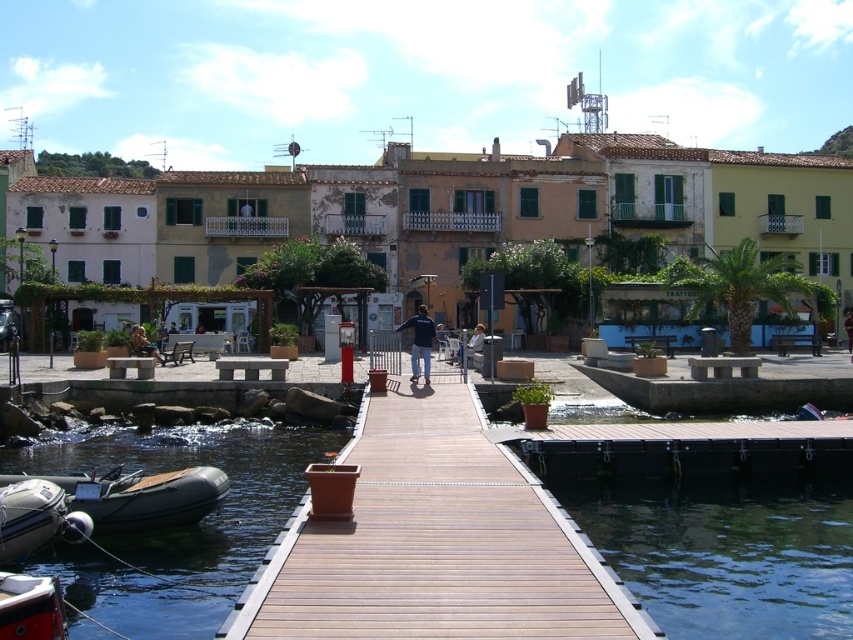
Question: Where is transparent blue water at dock center located in relation to rubber boat at lower left in the image?

Choices:
 (A) below
 (B) above

Answer: (A)

Question: Among these objects, which one is nearest to the camera?

Choices:
 (A) dark blue jacket at center
 (B) light blue denim jeans at center

Answer: (A)

Question: Which point is farther to the camera?

Choices:
 (A) (418, 355)
 (B) (154, 346)

Answer: (B)

Question: Is brown wooden dock at center to the left of transparent blue water at dock center from the viewer's perspective?

Choices:
 (A) yes
 (B) no

Answer: (A)

Question: Which of these objects is positioned farthest from the transparent blue water at dock center?

Choices:
 (A) dark blue jeans at center
 (B) rubber boat at lower left

Answer: (A)

Question: Is transparent blue water at dock center to the left of white rubber boat at lower left from the viewer's perspective?

Choices:
 (A) no
 (B) yes

Answer: (A)